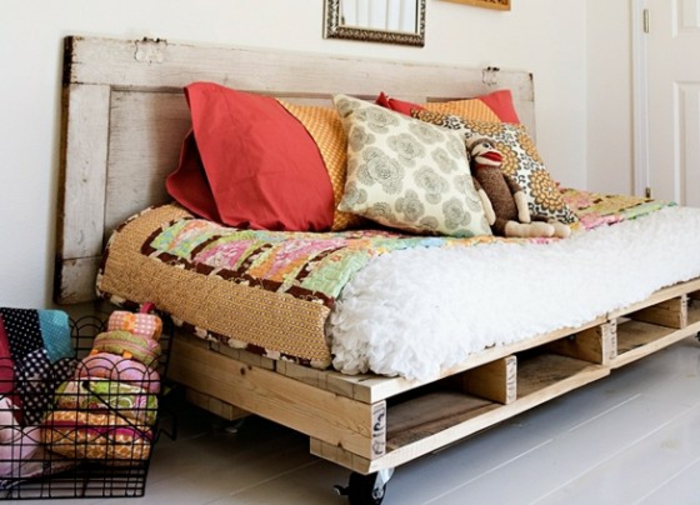
Identify the location of sock monkey legs. (542, 215), (526, 229).